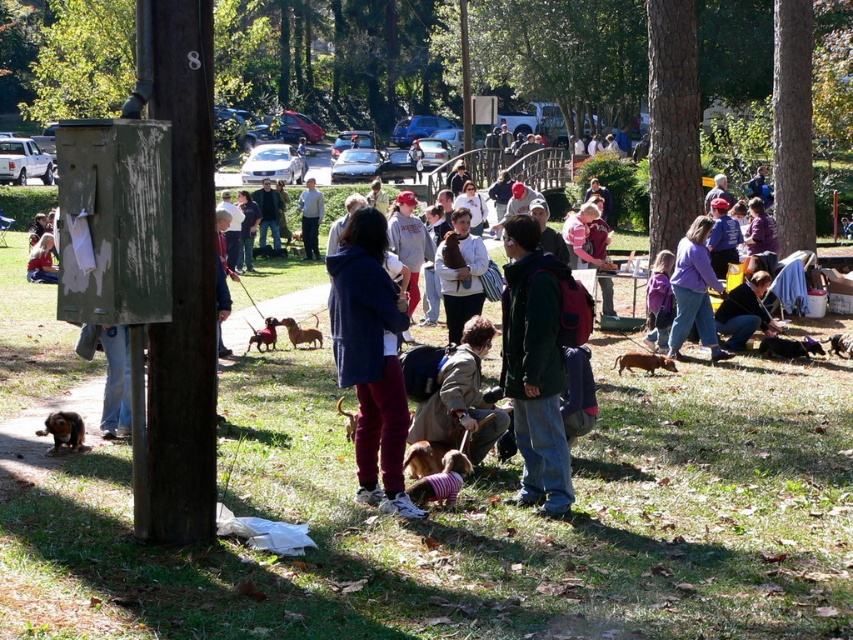
Question: Based on their relative distances, which object is nearer to the dark green jacket at center?

Choices:
 (A) purple fleece jacket at center
 (B) dark blue jacket at center

Answer: (B)

Question: Which object is the closest to the dark blue jacket at center?

Choices:
 (A) purple fleece jacket at center
 (B) brown furry dog at lower center
 (C) dark green jacket at center

Answer: (C)

Question: Can you confirm if dark blue jacket at center is thinner than dark green jacket at center?

Choices:
 (A) no
 (B) yes

Answer: (A)

Question: Which of the following is the farthest from the observer?

Choices:
 (A) dark blue jacket at center
 (B) brown furry dog at lower center
 (C) dark green jacket at center
 (D) purple fleece jacket at center

Answer: (D)

Question: Is dark blue jacket at center to the left of dark green jacket at center from the viewer's perspective?

Choices:
 (A) no
 (B) yes

Answer: (B)

Question: Is dark blue jacket at center closer to the viewer compared to purple fleece jacket at center?

Choices:
 (A) no
 (B) yes

Answer: (B)